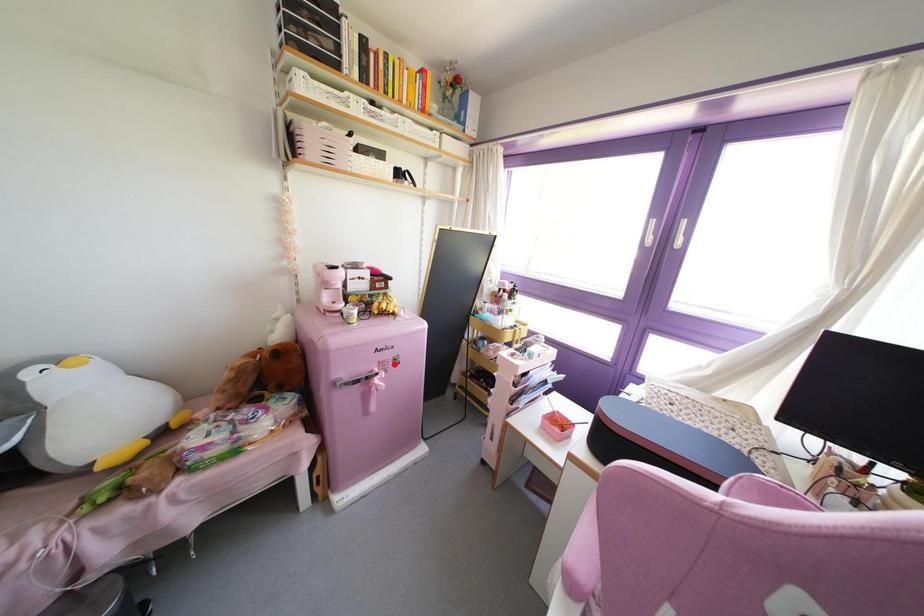
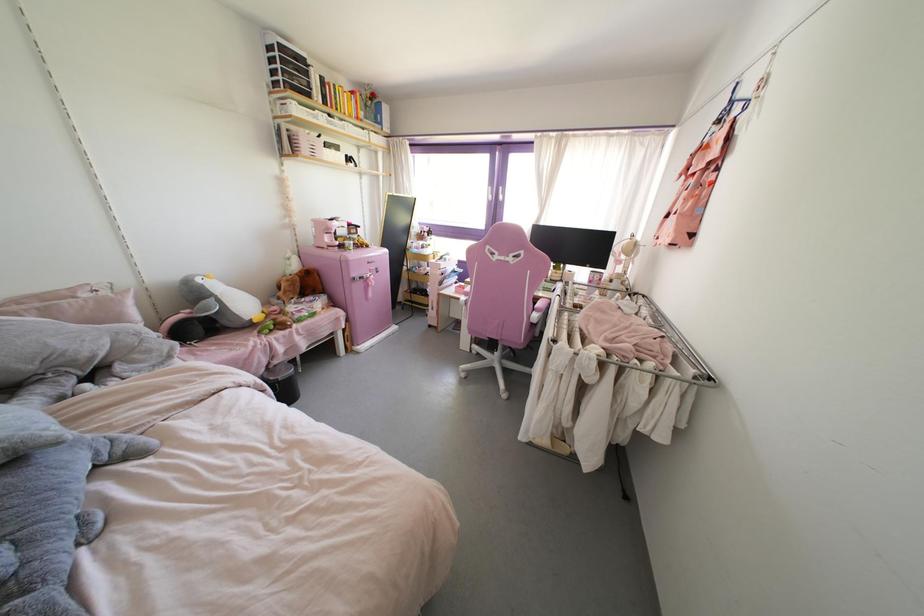
Question: I am providing you with two images of the same scene from different viewpoints. Image1 has a red point marked. In image2, the corresponding 3D location appears at what relative position? Reply with the corresponding letter.

Choices:
 (A) Closer
 (B) Farther

Answer: (A)